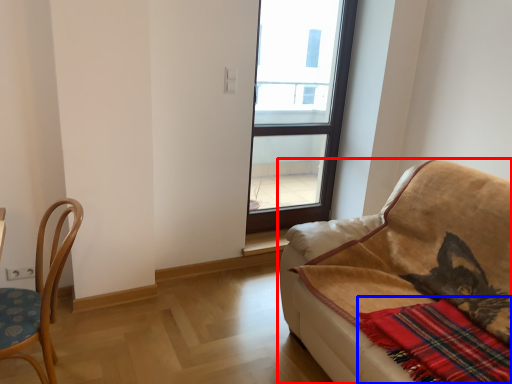
Question: Which of the following is the farthest to the observer, studio couch (highlighted by a red box) or plaid (highlighted by a blue box)?

Choices:
 (A) studio couch
 (B) plaid

Answer: (B)